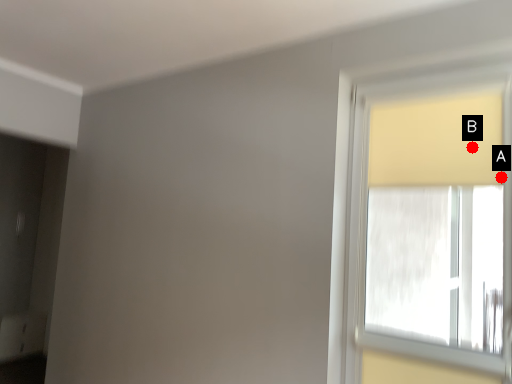
Question: Two points are circled on the image, labeled by A and B beside each circle. Which point appears farthest from the camera in this image?

Choices:
 (A) A is further
 (B) B is further

Answer: (B)